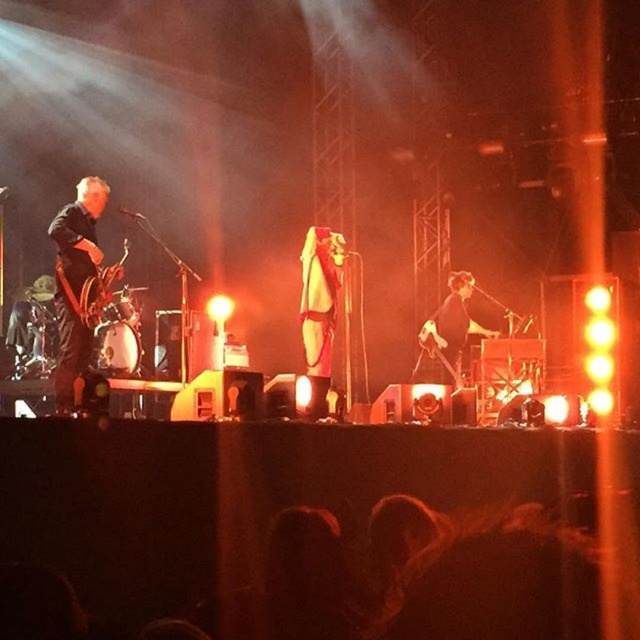
You are a photographer positioned at the camera. You want to capture a closeup of the dark blue leather jacket at left without moving the camera. Is the jacket within the camera lens range? The camera can focus on objects between 4 meters and 5 meters away.

The dark blue leather jacket at left is 4.46 meters from camera, which falls within the camera lens range of 4 meters to 5 meters. Therefore, the jacket can be captured in a closeup without moving the camera.

You are a stagehand carrying a 2.0 meter long ladder. You need to place it between the dark blue leather jacket at left and the white matte mask at center without moving either. Is this possible?

The distance between the dark blue leather jacket at left and the white matte mask at center is 1.94 meters. The ladder is 2.0 meters long, which is slightly longer than the available space. Therefore, the ladder cannot be placed between them without moving either object.